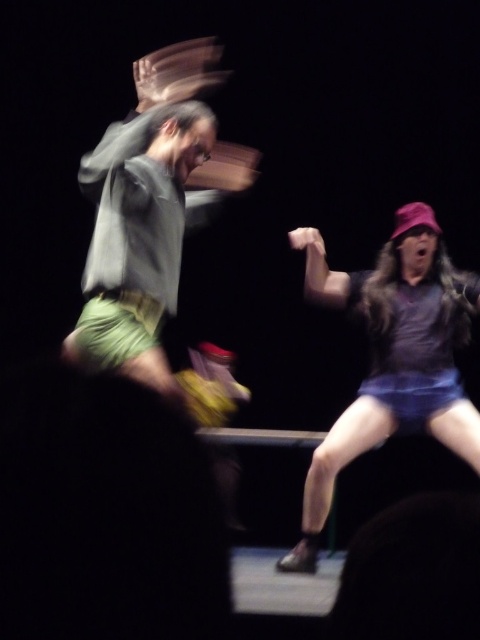
Question: Which point is farther to the camera?

Choices:
 (A) purple matte shirt at center
 (B) green cotton shorts at left

Answer: (A)

Question: Is green cotton shorts at left smaller than purple matte shirt at center?

Choices:
 (A) yes
 (B) no

Answer: (B)

Question: From the image, what is the correct spatial relationship of green cotton shorts at left in relation to purple matte shirt at center?

Choices:
 (A) left
 (B) right

Answer: (A)

Question: Is green cotton shorts at left smaller than purple matte shirt at center?

Choices:
 (A) yes
 (B) no

Answer: (B)